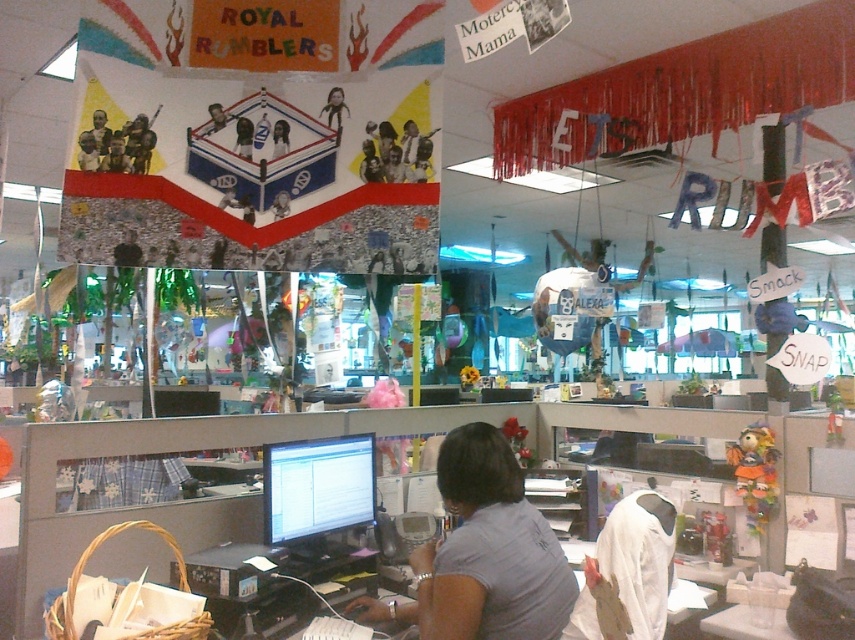
Question: Which object is closer to the camera taking this photo?

Choices:
 (A) gray fabric shirt at center
 (B) matte black monitor at center
 (C) matte black shirt at center
 (D) matte black helmet at upper center

Answer: (A)

Question: Which object appears closest to the camera in this image?

Choices:
 (A) smooth skin face at upper center
 (B) matte black laptop at upper left
 (C) matte black helmet at upper center

Answer: (B)

Question: Is gray fabric shirt at center closer to camera compared to smooth skin face at upper center?

Choices:
 (A) yes
 (B) no

Answer: (A)

Question: Which object is closer to the camera taking this photo?

Choices:
 (A) smooth skin face at upper center
 (B) matte black helmet at upper center
 (C) matte black laptop at upper left
 (D) matte black shirt at center

Answer: (C)

Question: Does gray fabric shirt at center come in front of matte black helmet at upper center?

Choices:
 (A) yes
 (B) no

Answer: (A)

Question: Is matte black monitor at center further to the viewer compared to matte black helmet at upper center?

Choices:
 (A) no
 (B) yes

Answer: (B)